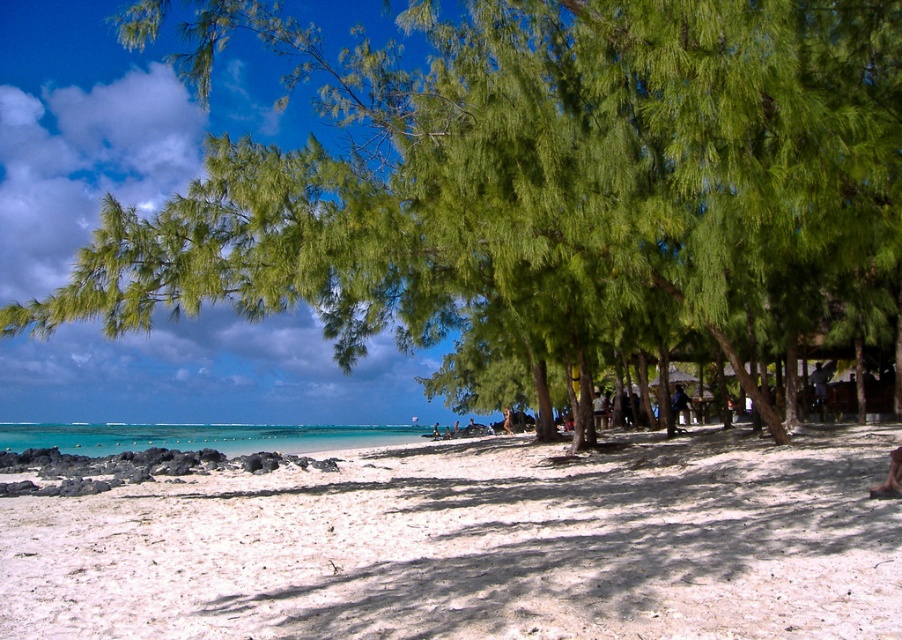
Question: Does white sandy beach at lower center come in front of turquoise water at lower left?

Choices:
 (A) no
 (B) yes

Answer: (B)

Question: Among these objects, which one is nearest to the camera?

Choices:
 (A) green leafy tree at center
 (B) white sandy beach at lower center
 (C) turquoise water at lower left

Answer: (B)

Question: Which of the following is the closest to the observer?

Choices:
 (A) white sandy beach at lower center
 (B) green leafy tree at center
 (C) turquoise water at lower left

Answer: (A)

Question: Can you confirm if green leafy tree at center is positioned above white sandy beach at lower center?

Choices:
 (A) yes
 (B) no

Answer: (A)

Question: Considering the relative positions of green leafy tree at center and white sandy beach at lower center in the image provided, where is green leafy tree at center located with respect to white sandy beach at lower center?

Choices:
 (A) above
 (B) below

Answer: (A)

Question: Which point is farther to the camera?

Choices:
 (A) (183, 426)
 (B) (269, 483)

Answer: (A)